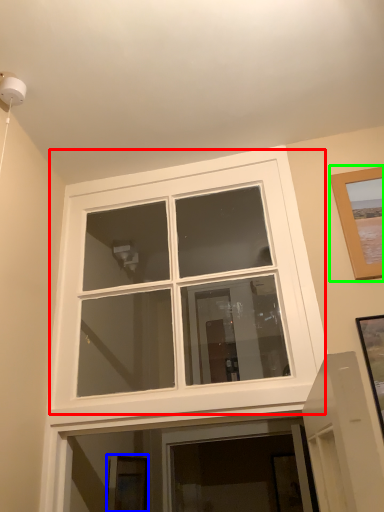
Question: Which object is positioned closest to window (highlighted by a red box)? Select from picture frame (highlighted by a blue box) and picture frame (highlighted by a green box).

Choices:
 (A) picture frame
 (B) picture frame

Answer: (A)